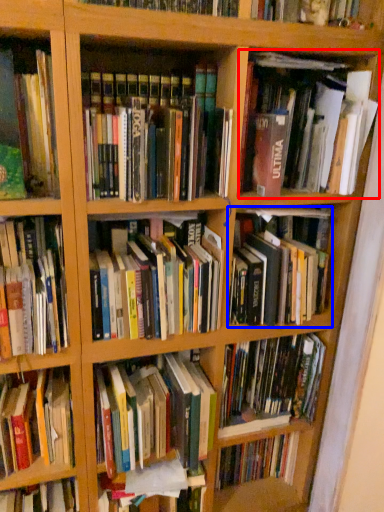
Question: Which point is closer to the camera, book (highlighted by a red box) or book (highlighted by a blue box)?

Choices:
 (A) book
 (B) book

Answer: (A)